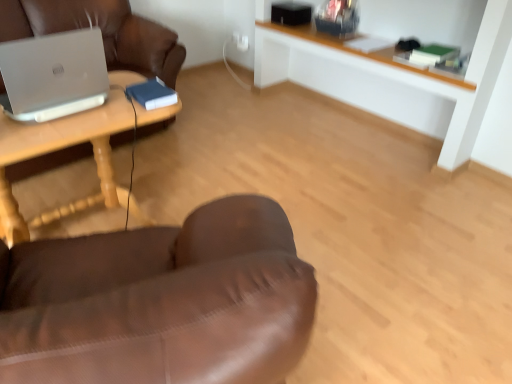
Question: Is wooden table at left outside of silver metallic laptop at left?

Choices:
 (A) yes
 (B) no

Answer: (A)

Question: Is wooden table at left shorter than silver metallic laptop at left?

Choices:
 (A) no
 (B) yes

Answer: (A)

Question: Is wooden table at left taller than silver metallic laptop at left?

Choices:
 (A) yes
 (B) no

Answer: (A)

Question: Is wooden table at left positioned with its back to silver metallic laptop at left?

Choices:
 (A) no
 (B) yes

Answer: (A)

Question: Is wooden table at left further to the viewer compared to silver metallic laptop at left?

Choices:
 (A) no
 (B) yes

Answer: (A)

Question: Is point (50, 71) positioned closer to the camera than point (82, 137)?

Choices:
 (A) closer
 (B) farther

Answer: (A)

Question: From the image's perspective, relative to wooden table at left, is silver metallic laptop at left above or below?

Choices:
 (A) above
 (B) below

Answer: (A)

Question: In the image, is silver metallic laptop at left on the left side or the right side of wooden table at left?

Choices:
 (A) left
 (B) right

Answer: (B)

Question: From a real-world perspective, is silver metallic laptop at left above or below wooden table at left?

Choices:
 (A) above
 (B) below

Answer: (A)

Question: Is point (483, 79) closer or farther from the camera than point (7, 221)?

Choices:
 (A) farther
 (B) closer

Answer: (A)

Question: Considering the positions of white wood shelf at upper center and wooden table at left in the image, is white wood shelf at upper center wider or thinner than wooden table at left?

Choices:
 (A) wide
 (B) thin

Answer: (B)

Question: In terms of size, does white wood shelf at upper center appear bigger or smaller than wooden table at left?

Choices:
 (A) small
 (B) big

Answer: (B)

Question: From a real-world perspective, relative to wooden table at left, is white wood shelf at upper center vertically above or below?

Choices:
 (A) above
 (B) below

Answer: (A)

Question: Considering their positions, is white wood shelf at upper center located in front of or behind silver metallic laptop at left?

Choices:
 (A) front
 (B) behind

Answer: (B)

Question: From a real-world perspective, relative to silver metallic laptop at left, is white wood shelf at upper center vertically above or below?

Choices:
 (A) below
 (B) above

Answer: (A)